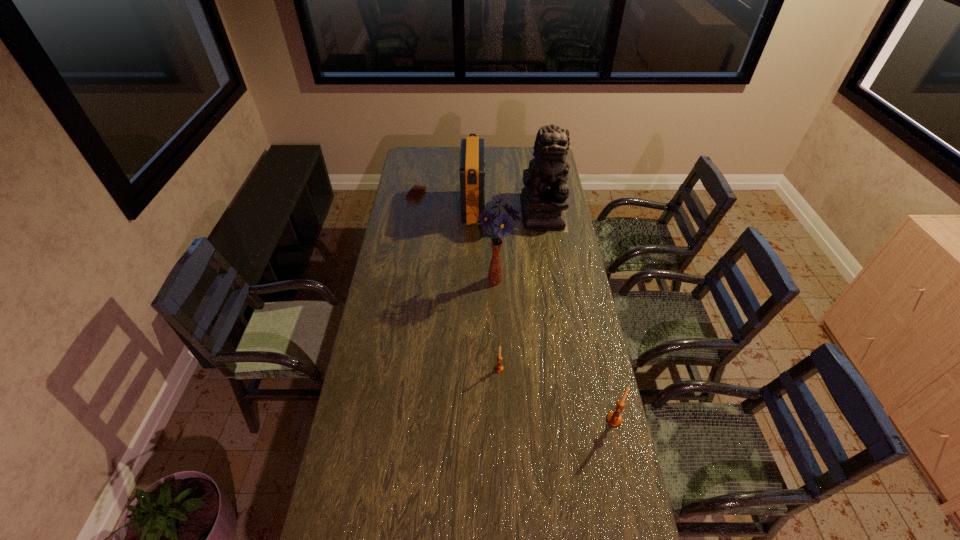
Where is `vacant space situated on the left of the nearest object`? vacant space situated on the left of the nearest object is located at coordinates (588, 420).

The height and width of the screenshot is (540, 960). I want to click on vacant region located on the front of the candy bar, so click(413, 218).

Locate an element on the screen. Image resolution: width=960 pixels, height=540 pixels. vacant area situated on the right of the flower arrangement is located at coordinates (558, 281).

Image resolution: width=960 pixels, height=540 pixels. What are the coordinates of `free region located on the front-facing side of the fourth shortest object` in the screenshot? It's located at (535, 208).

Locate an element on the screen. The height and width of the screenshot is (540, 960). free space located on the front-facing side of the sculpture is located at coordinates (548, 248).

You are a GUI agent. You are given a task and a screenshot of the screen. Output one action in this format:
    pyautogui.click(x=<x>, y=<y>)
    Task: Click on the object present at the left edge
    This screenshot has width=960, height=540.
    Given the screenshot: What is the action you would take?
    pyautogui.click(x=416, y=192)

Find the location of `candle_holder positioned at the right edge`. candle_holder positioned at the right edge is located at coordinates (613, 418).

Locate an element on the screen. This screenshot has width=960, height=540. sculpture at the right edge is located at coordinates (544, 198).

This screenshot has width=960, height=540. I want to click on free location at the far edge, so click(x=526, y=161).

This screenshot has height=540, width=960. What are the coordinates of `vacant space at the near edge of the desktop` in the screenshot? It's located at (462, 498).